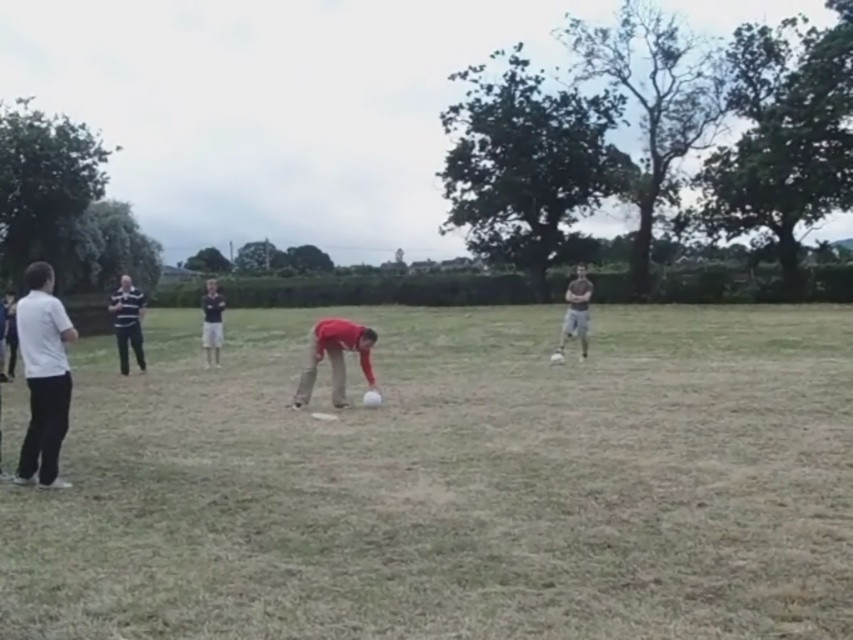
Question: Is white matte soccer ball at center above striped cotton shirt at left?

Choices:
 (A) no
 (B) yes

Answer: (A)

Question: Which point is closer to the camera?

Choices:
 (A) matte gray shirt at center
 (B) white matte shirt at left
 (C) white matte soccer ball at center

Answer: (C)

Question: Is white matte soccer ball at center above matte gray shirt at center?

Choices:
 (A) yes
 (B) no

Answer: (B)

Question: Which object appears closest to the camera in this image?

Choices:
 (A) striped polo shirt at center
 (B) white matte shirt at left

Answer: (B)

Question: Considering the relative positions of white matte soccer ball at center and white matte shirt at left in the image provided, where is white matte soccer ball at center located with respect to white matte shirt at left?

Choices:
 (A) left
 (B) right

Answer: (B)

Question: Which of the following is the farthest from the observer?

Choices:
 (A) white matte soccer ball at center
 (B) striped polo shirt at center
 (C) striped cotton shirt at left

Answer: (B)